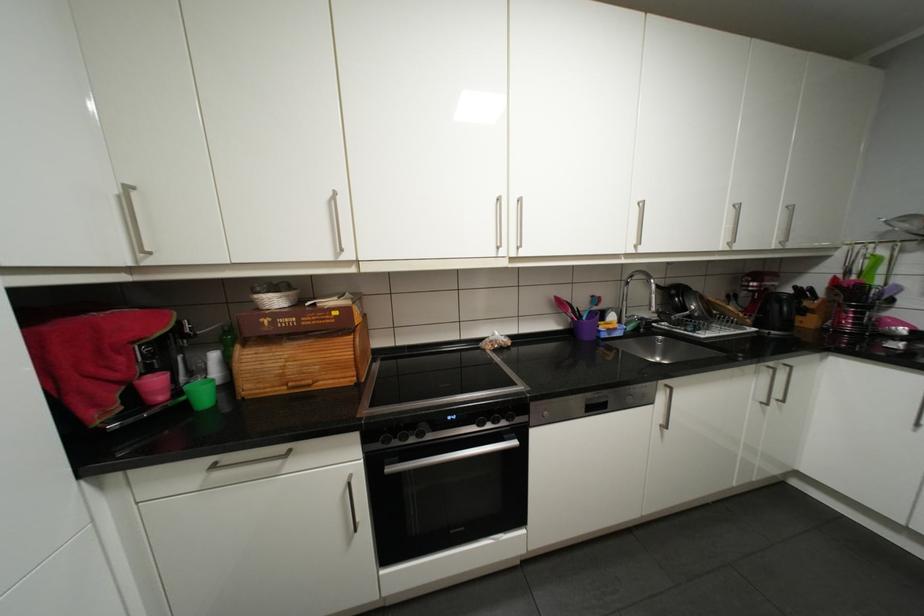
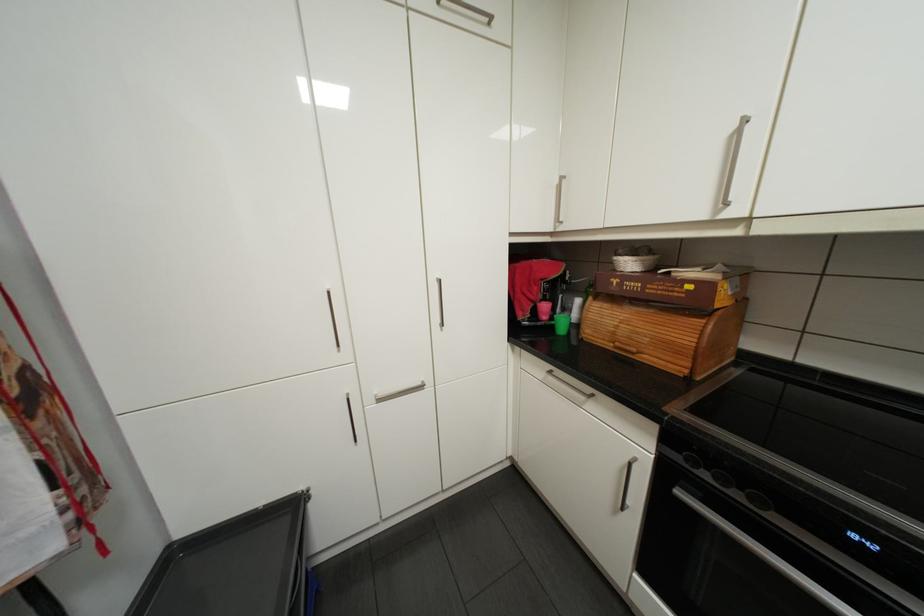
The point at (x=123, y=188) is marked in the first image. Where is the corresponding point in the second image?

(565, 180)